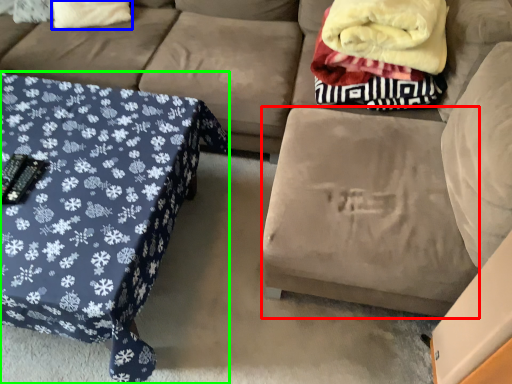
Question: Which is farther away from footrest (highlighted by a red box)? throw pillow (highlighted by a blue box) or table (highlighted by a green box)?

Choices:
 (A) throw pillow
 (B) table

Answer: (A)